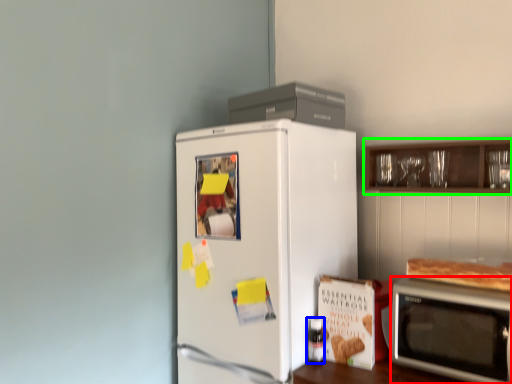
Question: Estimate the real-world distances between objects in this image. Which object is closer to microwave oven (highlighted by a red box), bottle (highlighted by a blue box) or cabinetry (highlighted by a green box)?

Choices:
 (A) bottle
 (B) cabinetry

Answer: (A)